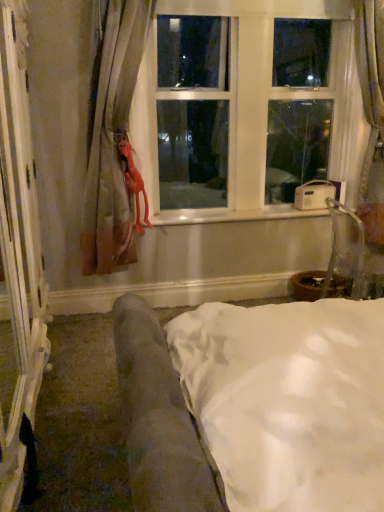
Question: Is matte beige curtain at left taller than white plastic window at upper center?

Choices:
 (A) yes
 (B) no

Answer: (A)

Question: Is matte beige curtain at left positioned in front of white plastic window at upper center?

Choices:
 (A) no
 (B) yes

Answer: (B)

Question: Can you confirm if matte beige curtain at left is wider than white plastic window at upper center?

Choices:
 (A) no
 (B) yes

Answer: (B)

Question: Does matte beige curtain at left contain white plastic window at upper center?

Choices:
 (A) no
 (B) yes

Answer: (A)

Question: Can you confirm if matte beige curtain at left is bigger than white plastic window at upper center?

Choices:
 (A) no
 (B) yes

Answer: (A)

Question: Is matte beige curtain at left thinner than white plastic window at upper center?

Choices:
 (A) no
 (B) yes

Answer: (A)

Question: From the image's perspective, is clear plastic armchair at right located beneath matte beige curtain at left?

Choices:
 (A) no
 (B) yes

Answer: (B)

Question: Is clear plastic armchair at right positioned before matte beige curtain at left?

Choices:
 (A) yes
 (B) no

Answer: (B)

Question: Does clear plastic armchair at right contain matte beige curtain at left?

Choices:
 (A) yes
 (B) no

Answer: (B)

Question: Does clear plastic armchair at right lie behind matte beige curtain at left?

Choices:
 (A) no
 (B) yes

Answer: (B)

Question: From the image's perspective, would you say clear plastic armchair at right is positioned over matte beige curtain at left?

Choices:
 (A) no
 (B) yes

Answer: (A)

Question: Can you confirm if clear plastic armchair at right is bigger than matte beige curtain at left?

Choices:
 (A) yes
 (B) no

Answer: (B)

Question: Is velvet fabric couch at lower left at the right side of clear plastic armchair at right?

Choices:
 (A) yes
 (B) no

Answer: (B)